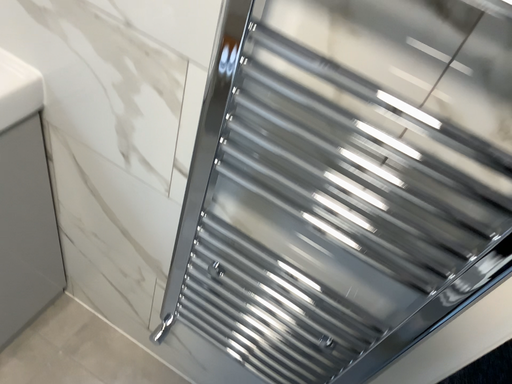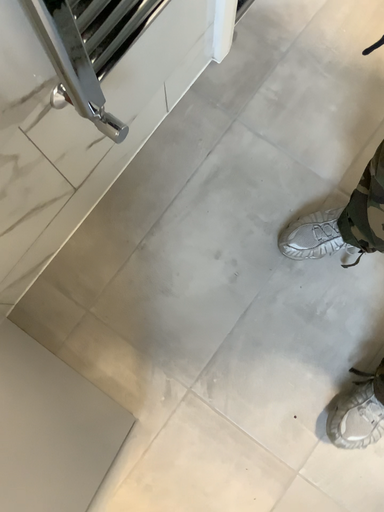
Question: How did the camera likely rotate when shooting the video?

Choices:
 (A) rotated right
 (B) rotated left

Answer: (A)